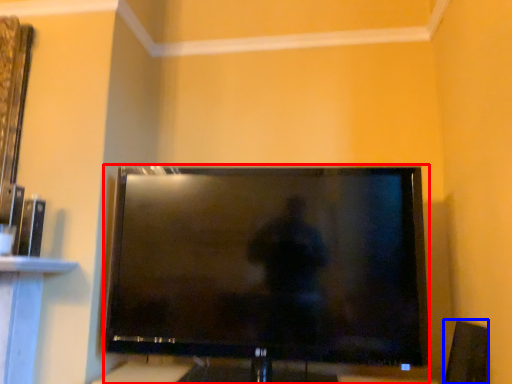
Question: Which point is further to the camera, television (highlighted by a red box) or speaker (highlighted by a blue box)?

Choices:
 (A) television
 (B) speaker

Answer: (B)